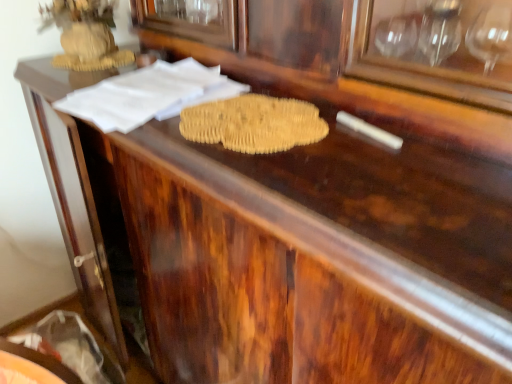
The width and height of the screenshot is (512, 384). Identify the location of free spot in front of baked golden bread at center. (290, 190).